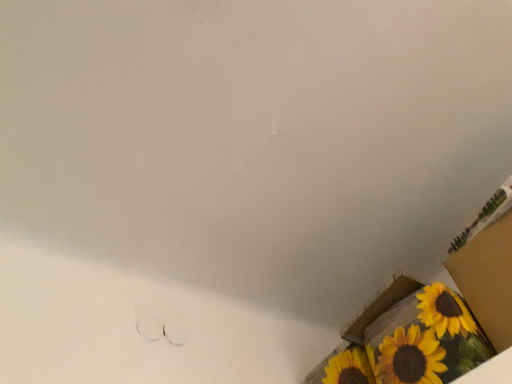
Question: Is yellow painted cardboard box at lower right, which ranks as the 1th cardboard box in bottom-to-top order, placed right next to cardboard box at lower right, marked as the 1th cardboard box in a top-to-bottom arrangement?

Choices:
 (A) yes
 (B) no

Answer: (B)

Question: Could you tell me if yellow painted cardboard box at lower right, which ranks as the 1th cardboard box in bottom-to-top order, is turned towards cardboard box at lower right, marked as the 1th cardboard box in a top-to-bottom arrangement?

Choices:
 (A) no
 (B) yes

Answer: (A)

Question: Is yellow painted cardboard box at lower right, the 2th cardboard box positioned from the top, to the left of cardboard box at lower right, the 2th cardboard box when ordered from bottom to top, from the viewer's perspective?

Choices:
 (A) no
 (B) yes

Answer: (B)

Question: From the image's perspective, is yellow painted cardboard box at lower right, the 2th cardboard box positioned from the top, on top of cardboard box at lower right, marked as the 1th cardboard box in a top-to-bottom arrangement?

Choices:
 (A) yes
 (B) no

Answer: (B)

Question: Is yellow painted cardboard box at lower right, the 2th cardboard box positioned from the top, positioned far away from cardboard box at lower right, marked as the 1th cardboard box in a top-to-bottom arrangement?

Choices:
 (A) yes
 (B) no

Answer: (B)

Question: Is cardboard box at lower right, marked as the 1th cardboard box in a top-to-bottom arrangement, located within yellow painted cardboard box at lower right, which ranks as the 1th cardboard box in bottom-to-top order?

Choices:
 (A) yes
 (B) no

Answer: (B)

Question: Can you confirm if cardboard box at lower right, the 2th cardboard box when ordered from bottom to top, is taller than yellow painted cardboard box at lower right, which ranks as the 1th cardboard box in bottom-to-top order?

Choices:
 (A) yes
 (B) no

Answer: (A)

Question: Considering the relative sizes of cardboard box at lower right, the 2th cardboard box when ordered from bottom to top, and yellow painted cardboard box at lower right, the 2th cardboard box positioned from the top, in the image provided, is cardboard box at lower right, the 2th cardboard box when ordered from bottom to top, wider than yellow painted cardboard box at lower right, the 2th cardboard box positioned from the top,?

Choices:
 (A) yes
 (B) no

Answer: (B)

Question: Is cardboard box at lower right, the 2th cardboard box when ordered from bottom to top, positioned far away from yellow painted cardboard box at lower right, which ranks as the 1th cardboard box in bottom-to-top order?

Choices:
 (A) no
 (B) yes

Answer: (A)

Question: Would you say yellow painted cardboard box at lower right, which ranks as the 1th cardboard box in bottom-to-top order, is part of cardboard box at lower right, marked as the 1th cardboard box in a top-to-bottom arrangement,'s contents?

Choices:
 (A) no
 (B) yes

Answer: (A)

Question: From the image's perspective, is cardboard box at lower right, the 2th cardboard box when ordered from bottom to top, under yellow painted cardboard box at lower right, which ranks as the 1th cardboard box in bottom-to-top order?

Choices:
 (A) no
 (B) yes

Answer: (A)

Question: Is cardboard box at lower right, the 2th cardboard box when ordered from bottom to top, oriented away from yellow painted cardboard box at lower right, the 2th cardboard box positioned from the top?

Choices:
 (A) no
 (B) yes

Answer: (A)

Question: From the image's perspective, relative to yellow painted cardboard box at lower right, which ranks as the 1th cardboard box in bottom-to-top order, is cardboard box at lower right, marked as the 1th cardboard box in a top-to-bottom arrangement, above or below?

Choices:
 (A) above
 (B) below

Answer: (A)